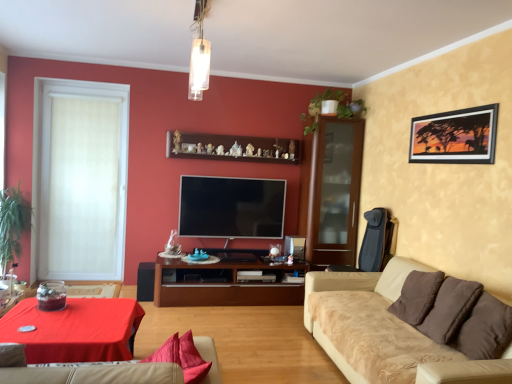
Locate an element on the screen. This screenshot has height=384, width=512. flat screen tv at center is located at coordinates (231, 207).

What is the approximate width of silk matte painting at upper right?

1.54 inches.

Image resolution: width=512 pixels, height=384 pixels. What do you see at coordinates (231, 147) in the screenshot?
I see `wooden shelf at upper center` at bounding box center [231, 147].

Find the location of `white glass pendant light at upper center`. white glass pendant light at upper center is located at coordinates (199, 55).

Measure the distance between point [204,83] and camera.

The distance of point [204,83] from camera is 2.49 meters.

What do you see at coordinates (95, 374) in the screenshot?
I see `beige fabric couch at lower center, placed as the 2th studio couch when sorted from right to left` at bounding box center [95, 374].

What is the approximate height of white textured window at left?

7.62 feet.

Locate an element on the screen. The height and width of the screenshot is (384, 512). wooden cabinet at center is located at coordinates (223, 284).

Are wooden shelf at upper center and wooden cabinet at center located far from each other?

wooden shelf at upper center is positioned a significant distance from wooden cabinet at center.

Looking at this image, considering the sizes of wooden shelf at upper center and wooden cabinet at center in the image, is wooden shelf at upper center taller or shorter than wooden cabinet at center?

Clearly, wooden shelf at upper center is shorter compared to wooden cabinet at center.

In order to click on cabinetry in front of the wooden shelf at upper center in this screenshot , I will do `click(223, 284)`.

Is wooden shelf at upper center positioned with its back to wooden cabinet at center?

wooden shelf at upper center is not turned away from wooden cabinet at center.

Is matte black speaker at lower left inside or outside of silk matte painting at upper right?

matte black speaker at lower left is spatially situated outside silk matte painting at upper right.

Does matte black speaker at lower left have a greater width compared to silk matte painting at upper right?

Yes.

Is matte black speaker at lower left shorter than silk matte painting at upper right?

Yes.

Is point (105, 207) closer to viewer compared to point (265, 228)?

No, it is behind (265, 228).

Considering the relative sizes of white textured window at left and flat screen tv at center in the image provided, is white textured window at left taller than flat screen tv at center?

Yes, white textured window at left is taller than flat screen tv at center.

Based on the photo, is white textured window at left far from flat screen tv at center?

Absolutely, white textured window at left is distant from flat screen tv at center.

From a real-world perspective, is white textured window at left on flat screen tv at center?

Yes, from a real-world perspective, white textured window at left is above flat screen tv at center.

From the image's perspective, which one is positioned lower, beige fabric couch at lower center, acting as the first studio couch starting from the left, or white glass pendant light at upper center?

From the image's view, beige fabric couch at lower center, acting as the first studio couch starting from the left, is below.

Is beige fabric couch at lower center, acting as the first studio couch starting from the left, touching white glass pendant light at upper center?

No.

Does beige fabric couch at lower center, acting as the first studio couch starting from the left, have a greater width compared to white glass pendant light at upper center?

Yes.

Does beige fabric couch at lower center, placed as the 2th studio couch when sorted from right to left, have a smaller size compared to white glass pendant light at upper center?

Actually, beige fabric couch at lower center, placed as the 2th studio couch when sorted from right to left, might be larger than white glass pendant light at upper center.

Which object is wider, white glass pendant light at upper center or flat screen tv at center?

With larger width is white glass pendant light at upper center.

Based on the photo, which is correct: white glass pendant light at upper center is inside flat screen tv at center, or outside of it?

white glass pendant light at upper center cannot be found inside flat screen tv at center.

In the image, is white glass pendant light at upper center positioned in front of or behind flat screen tv at center?

Visually, white glass pendant light at upper center is located in front of flat screen tv at center.

Is white glass pendant light at upper center directly adjacent to flat screen tv at center?

white glass pendant light at upper center and flat screen tv at center are clearly separated.

Based on the photo, between green leafy plant at left, positioned as the 1th plant in bottom-to-top order, and green leafy plant at upper right, the first plant viewed from the right, which one has larger width?

Wider between the two is green leafy plant at left, positioned as the 1th plant in bottom-to-top order.

Is green leafy plant at left, positioned as the 1th plant in bottom-to-top order, turned away from green leafy plant at upper right, the second plant positioned from the left?

green leafy plant at left, positioned as the 1th plant in bottom-to-top order, is not turned away from green leafy plant at upper right, the second plant positioned from the left.

You are a GUI agent. You are given a task and a screenshot of the screen. Output one action in this format:
    pyautogui.click(x=<x>, y=<y>)
    Task: Click on the plant above the green leafy plant at left, which is the first plant in left-to-right order (from the image's perspective)
    This screenshot has height=384, width=512.
    Given the screenshot: What is the action you would take?
    pyautogui.click(x=337, y=107)

Which of these two, beige fabric couch at lower right, marked as the first studio couch in a right-to-left arrangement, or white glass pendant light at upper center, is wider?

With larger width is beige fabric couch at lower right, marked as the first studio couch in a right-to-left arrangement.

Find the location of a particular element. light fixture lying above the beige fabric couch at lower right, placed as the second studio couch when sorted from left to right (from the image's perspective) is located at coordinates (199, 55).

Is beige fabric couch at lower right, marked as the first studio couch in a right-to-left arrangement, positioned beyond the bounds of white glass pendant light at upper center?

beige fabric couch at lower right, marked as the first studio couch in a right-to-left arrangement, is positioned outside white glass pendant light at upper center.

Between beige fabric couch at lower right, marked as the first studio couch in a right-to-left arrangement, and white glass pendant light at upper center, which one has larger size?

With larger size is beige fabric couch at lower right, marked as the first studio couch in a right-to-left arrangement.

Identify the location of cabinetry below the wooden shelf at upper center (from a real-world perspective). The image size is (512, 384). (223, 284).

The width and height of the screenshot is (512, 384). I want to click on speaker that is behind the silk matte painting at upper right, so click(x=145, y=281).

Looking at the image, which one is located closer to green leafy plant at upper right, the second plant positioned from the left, matte black speaker at lower left or transparent glass cabinet at right?

The object closer to green leafy plant at upper right, the second plant positioned from the left, is transparent glass cabinet at right.

When comparing their distances from green leafy plant at upper right, acting as the first plant starting from the top, does wooden cabinet at center or flat screen tv at center seem closer?

flat screen tv at center is positioned closer to the anchor green leafy plant at upper right, acting as the first plant starting from the top.

When comparing their distances from wooden cabinet at center, does beige fabric couch at lower center, acting as the first studio couch starting from the left, or green leafy plant at upper right, which is the 2th plant from bottom to top, seem further?

Based on the image, beige fabric couch at lower center, acting as the first studio couch starting from the left, appears to be further to wooden cabinet at center.

When comparing their distances from green leafy plant at left, placed as the 2th plant when sorted from top to bottom, does wooden shelf at upper center or wooden cabinet at center seem further?

Among the two, wooden cabinet at center is located further to green leafy plant at left, placed as the 2th plant when sorted from top to bottom.

When comparing their distances from beige fabric couch at lower center, acting as the first studio couch starting from the left, does green leafy plant at left, placed as the 2th plant when sorted from top to bottom, or wooden shelf at upper center seem closer?

wooden shelf at upper center is closer to beige fabric couch at lower center, acting as the first studio couch starting from the left.

In the scene shown: From the image, which object appears to be nearer to white glass pendant light at upper center, silk matte painting at upper right or matte black speaker at lower left?

silk matte painting at upper right is positioned closer to the anchor white glass pendant light at upper center.

Based on their spatial positions, is green leafy plant at left, placed as the 2th plant when sorted from top to bottom, or beige fabric couch at lower center, acting as the first studio couch starting from the left, closer to transparent glass cabinet at right?

Among the two, green leafy plant at left, placed as the 2th plant when sorted from top to bottom, is located nearer to transparent glass cabinet at right.

Which object lies nearer to the anchor point smooth red tablecloth at lower left, flat screen tv at center or wooden shelf at upper center?

Among the two, flat screen tv at center is located nearer to smooth red tablecloth at lower left.

Find the location of a particular element. This screenshot has height=384, width=512. speaker located between white glass pendant light at upper center and transparent glass cabinet at right in the depth direction is located at coordinates coord(145,281).

Locate an element on the screen. light fixture located between white textured window at left and green leafy plant at upper right, acting as the first plant starting from the top, in the left-right direction is located at coordinates 199,55.

Where is `window located between beige fabric couch at lower right, marked as the first studio couch in a right-to-left arrangement, and flat screen tv at center in the depth direction`? The image size is (512, 384). window located between beige fabric couch at lower right, marked as the first studio couch in a right-to-left arrangement, and flat screen tv at center in the depth direction is located at coordinates (79, 180).

Find the location of a particular element. Image resolution: width=512 pixels, height=384 pixels. light fixture between beige fabric couch at lower center, acting as the first studio couch starting from the left, and silk matte painting at upper right, in the horizontal direction is located at coordinates (199, 55).